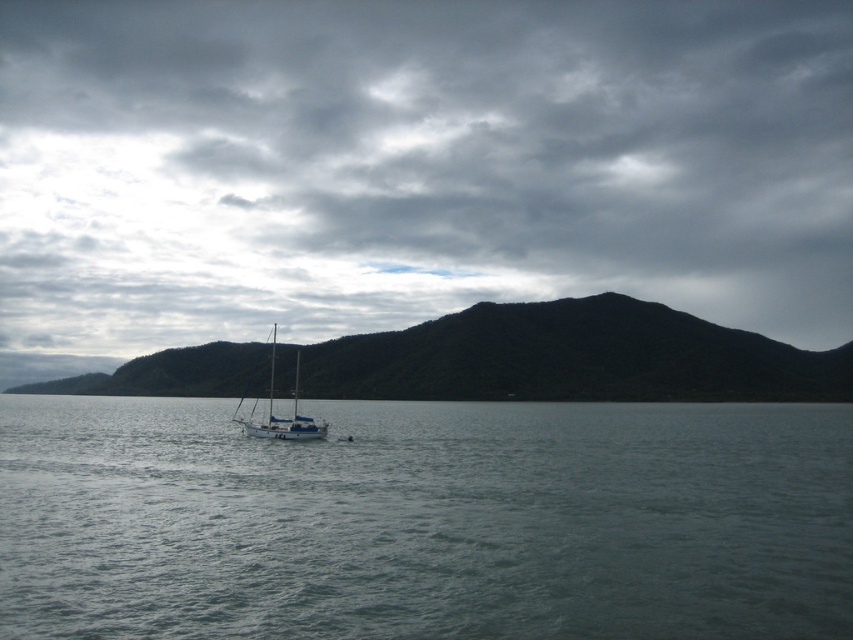
You are standing on the deck of the sailboat in the image and see two points marked on the water. The first point is at coordinates point [637,438] and the second point is at point [401,356]. Which point is closer to you?

Point [637,438] is in front of point [401,356], so the first point is closer to you.

In the scene shown: You are a bird flying over the maritime scene. You see the clear water at center and the green matte mountain at center. Which one is positioned higher from your perspective?

The clear water at center is positioned higher than the green matte mountain at center from your perspective.